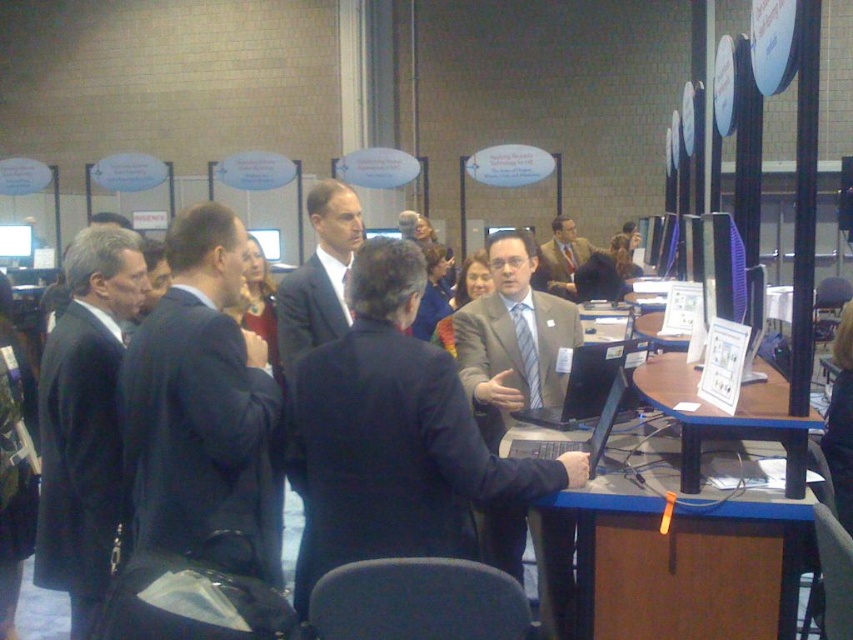
Can you confirm if light brown suit at center is positioned above matte black laptop at center?

No.

Between point (498, 464) and point (624, 406), which one is positioned behind?

The point (624, 406) is more distant.

Where is `light brown suit at center`? The image size is (853, 640). light brown suit at center is located at coordinates (393, 436).

Between point (563, 316) and point (688, 468), which one is positioned behind?

The point (563, 316) is behind.

You are a GUI agent. You are given a task and a screenshot of the screen. Output one action in this format:
    pyautogui.click(x=<x>, y=<y>)
    Task: Click on the gray suit at center
    This screenshot has width=853, height=640.
    Given the screenshot: What is the action you would take?
    pyautogui.click(x=512, y=339)

The width and height of the screenshot is (853, 640). I want to click on gray suit at center, so click(512, 339).

Is dark blue suit at left to the left of wooden table at center from the viewer's perspective?

Yes, dark blue suit at left is to the left of wooden table at center.

Is point (108, 464) in front of point (697, 456)?

No, it is not.

Where is `dark blue suit at left`? This screenshot has width=853, height=640. dark blue suit at left is located at coordinates (85, 419).